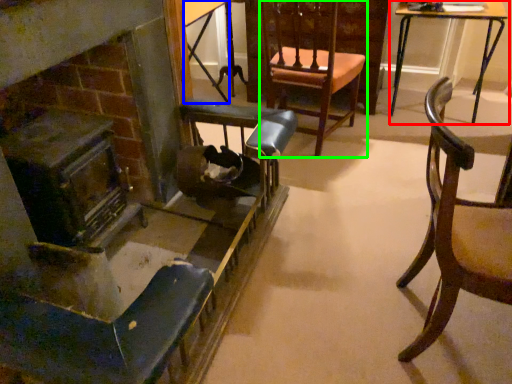
Question: Based on their relative distances, which object is farther from table (highlighted by a red box)? Choose from table (highlighted by a blue box) and chair (highlighted by a green box).

Choices:
 (A) table
 (B) chair

Answer: (A)